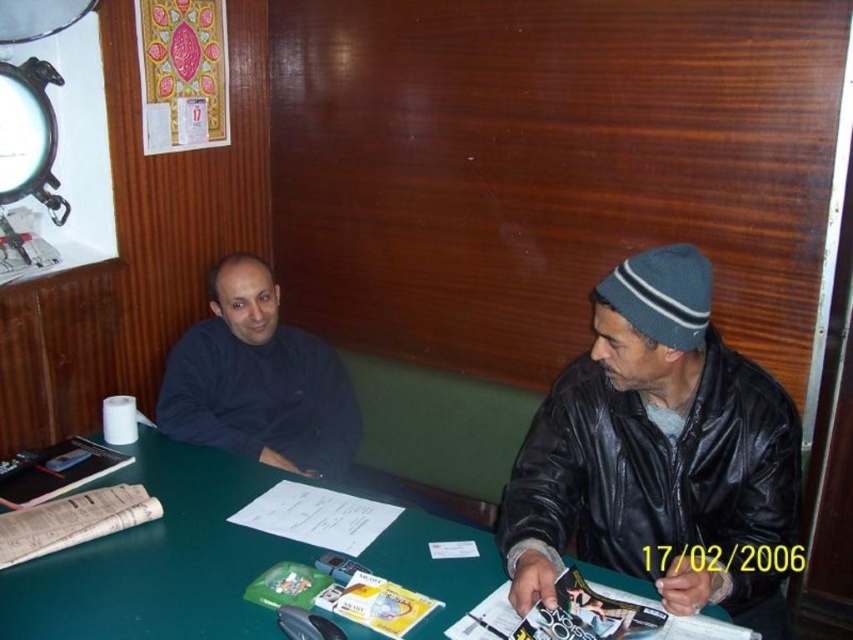
Question: Among these points, which one is farthest from the camera?

Choices:
 (A) (612, 280)
 (B) (238, 358)
 (C) (438, 636)

Answer: (B)

Question: Considering the real-world distances, which object is farthest from the dark blue sweater at center?

Choices:
 (A) leather jacket at right
 (B) green matte table at center

Answer: (A)

Question: Can you confirm if leather jacket at right is positioned to the left of green matte table at center?

Choices:
 (A) yes
 (B) no

Answer: (B)

Question: From the image, what is the correct spatial relationship of green matte table at center in relation to dark blue sweater at center?

Choices:
 (A) below
 (B) above

Answer: (A)

Question: Is leather jacket at right above dark blue sweater at center?

Choices:
 (A) yes
 (B) no

Answer: (B)

Question: Which object appears closest to the camera in this image?

Choices:
 (A) dark blue sweater at center
 (B) leather jacket at right
 (C) green matte table at center

Answer: (B)